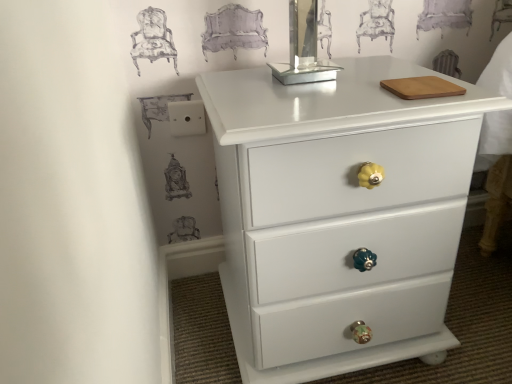
I want to click on vacant area on top of white glossy chest of drawers at center (from a real-world perspective), so click(x=335, y=85).